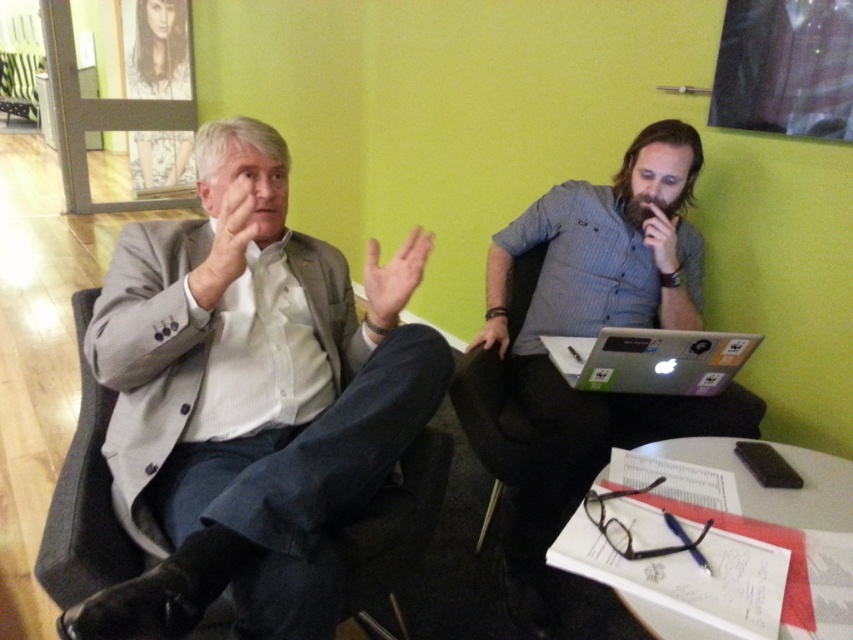
Question: Which point is closer to the camera?

Choices:
 (A) matte gray shirt at center
 (B) light gray suit at left

Answer: (B)

Question: Is light gray suit at left below matte gray shirt at center?

Choices:
 (A) no
 (B) yes

Answer: (A)

Question: Does light gray suit at left appear on the left side of matte gray shirt at center?

Choices:
 (A) yes
 (B) no

Answer: (A)

Question: Which is farther from the silver metallic laptop at center right?

Choices:
 (A) light gray suit at left
 (B) matte gray shirt at center

Answer: (A)

Question: Is light gray suit at left to the right of silver metallic laptop at center right from the viewer's perspective?

Choices:
 (A) no
 (B) yes

Answer: (A)

Question: Which object is positioned closest to the silver metallic laptop at center right?

Choices:
 (A) light gray suit at left
 (B) matte gray shirt at center

Answer: (B)